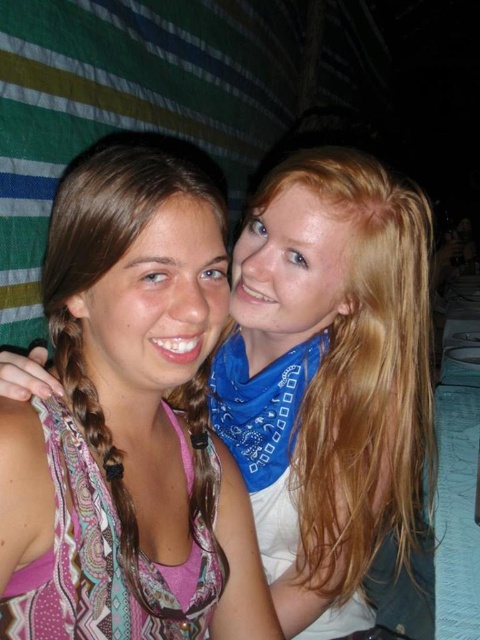
Based on the photo, you are a photographer trying to decide where to place a new accessory between the two people in the image. The multicolored scarf at center and the paisley fabric scarf at left are already present. Which scarf should you place closer to the camera to make it appear larger?

The multicolored scarf at center is already bigger than the paisley fabric scarf at left, so placing it closer to the camera would make it appear even larger.

You are a photographer holding a camera that requires a minimum distance of 12 inches between subjects to focus properly. You see the multicolored scarf at center and the paisley fabric scarf at left in your frame. Can the camera focus on both scarves?

The distance between the multicolored scarf at center and paisley fabric scarf at left is 14.11 inches, which is greater than the required 12 inches. Therefore, the camera can focus on both scarves.

You are a photographer trying to focus on the multicolored scarf at center and the paisley fabric scarf at left. Which scarf is closer to you?

The multicolored scarf at center is closer to you because it is further to the viewer than the paisley fabric scarf at left.